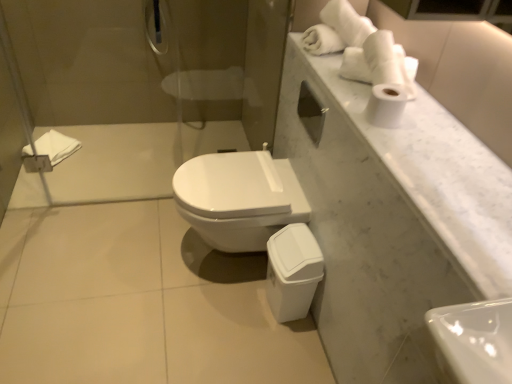
At what (x,y) coordinates should I click in order to perform the action: click on unoccupied region to the right of white matte toilet paper at upper right. Please return your answer as a coordinate pair (x, y). This screenshot has width=512, height=384. Looking at the image, I should click on (424, 123).